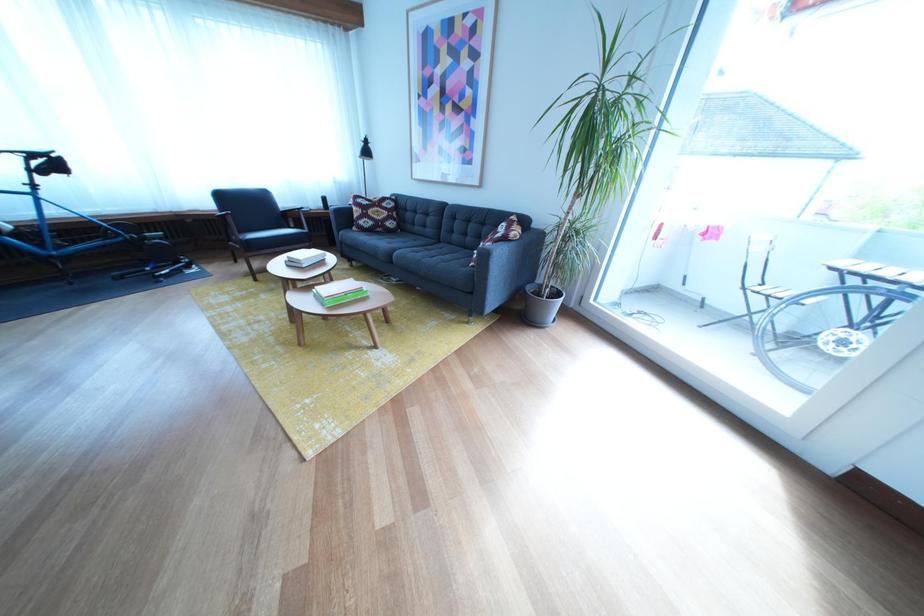
You are a GUI agent. You are given a task and a screenshot of the screen. Output one action in this format:
    pyautogui.click(x=<x>, y=<y>)
    Task: Click on the patterned pillow
    Image resolution: width=924 pixels, height=616 pixels.
    Given the screenshot: What is the action you would take?
    pyautogui.click(x=373, y=223)